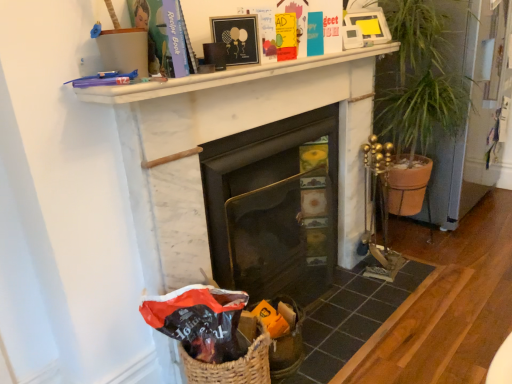
Locate an element on the screen. This screenshot has width=512, height=384. free spot to the right of white marble fireplace at center, the first fireplace in the right-to-left sequence is located at coordinates (357, 301).